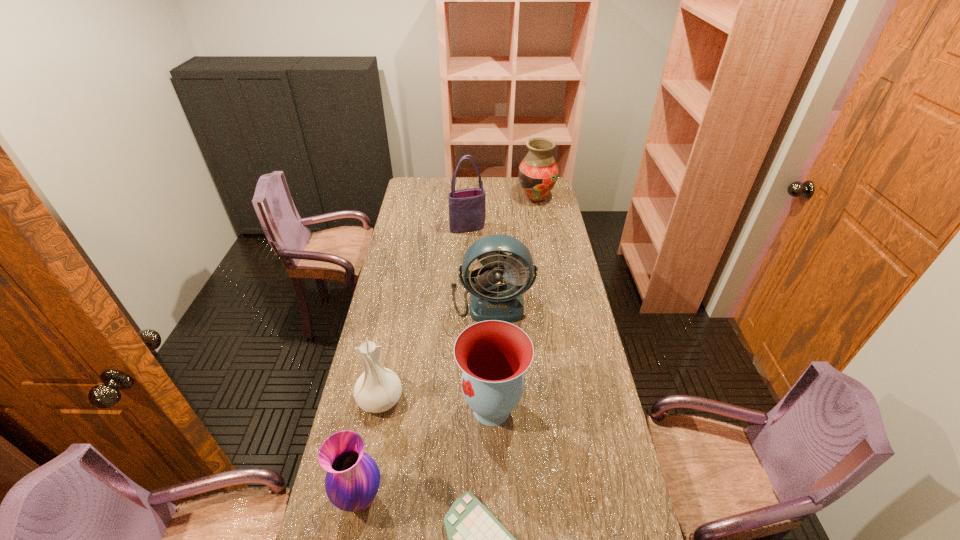
Locate an element on the screen. blank space located on the back of the nearest vase is located at coordinates (376, 416).

Find the location of a particular element. Image resolution: width=960 pixels, height=540 pixels. object that is at the far edge is located at coordinates pyautogui.click(x=538, y=172).

At what (x,y) coordinates should I click in order to perform the action: click on object that is at the right edge. Please return your answer as a coordinate pair (x, y). Image resolution: width=960 pixels, height=540 pixels. Looking at the image, I should click on click(538, 172).

Locate an element on the screen. The width and height of the screenshot is (960, 540). object located in the far right corner section of the desktop is located at coordinates (538, 172).

The image size is (960, 540). Identify the location of free point at the far edge. (455, 186).

Find the location of a particular element. This screenshot has width=960, height=540. free space at the left edge of the desktop is located at coordinates (395, 258).

Locate an element on the screen. The width and height of the screenshot is (960, 540). vacant space at the right edge of the desktop is located at coordinates (558, 362).

This screenshot has height=540, width=960. Identify the location of free space at the far left corner. (410, 183).

Locate an element on the screen. free space between the tote bag and the farthest vase is located at coordinates (502, 213).

Find the location of a particular element. The image size is (960, 540). vacant space that is in between the farthest vase and the second farthest object is located at coordinates (502, 213).